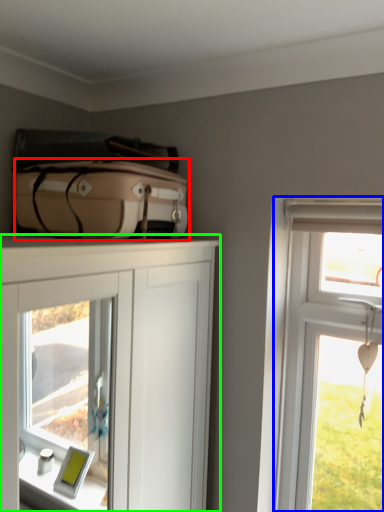
Question: Which object is positioned closest to suitcase (highlighted by a red box)? Select from window (highlighted by a blue box) and cabinetry (highlighted by a green box).

Choices:
 (A) window
 (B) cabinetry

Answer: (A)